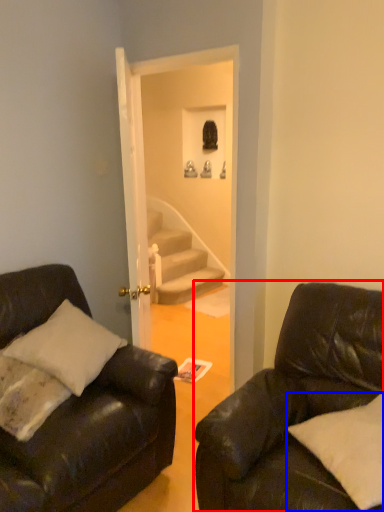
Question: Among these objects, which one is nearest to the camera, studio couch (highlighted by a red box) or pillow (highlighted by a blue box)?

Choices:
 (A) studio couch
 (B) pillow

Answer: (A)